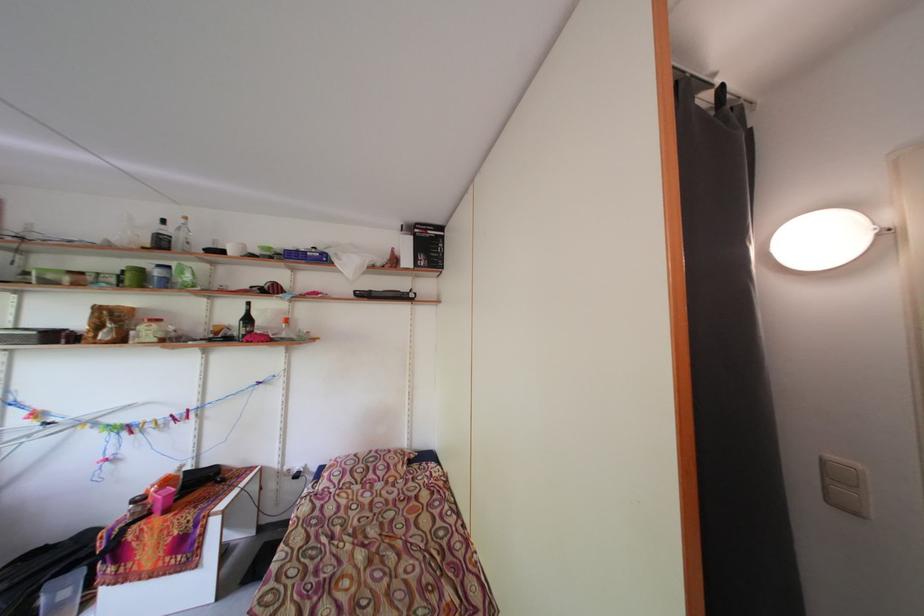
Where would you press the double light switch? Please return your answer as a coordinate pair (x, y).

(844, 485)